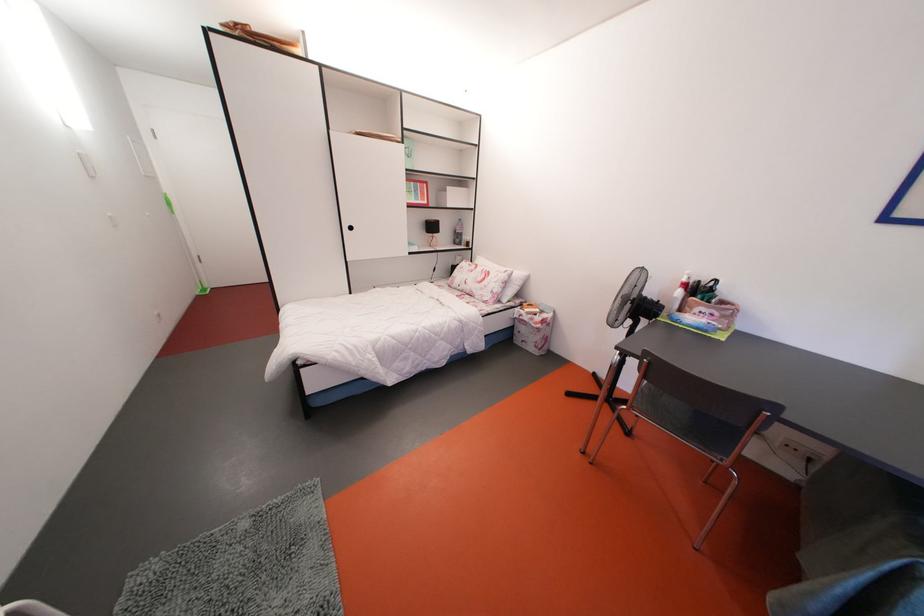
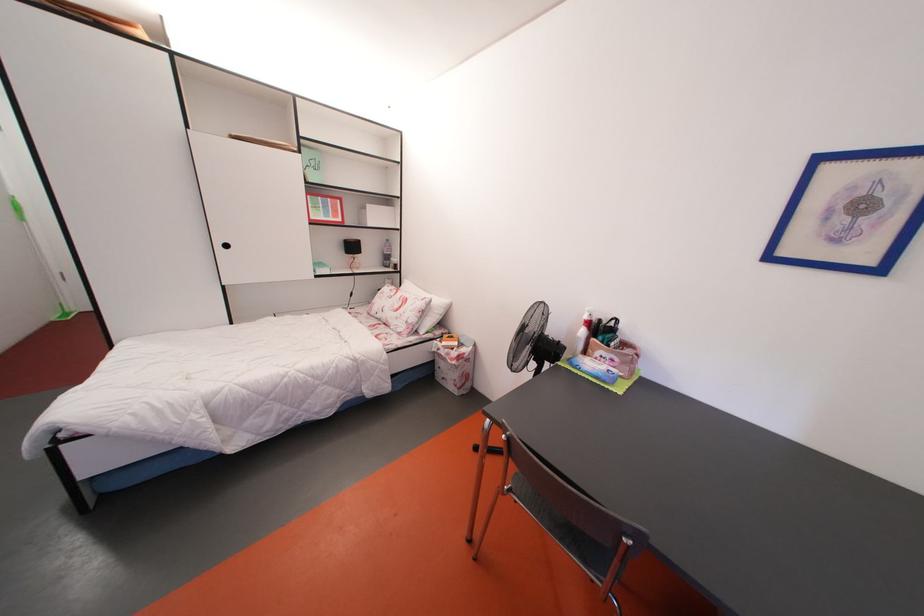
Where in the second image is the point corresponding to point 637,328 from the first image?

(541, 370)